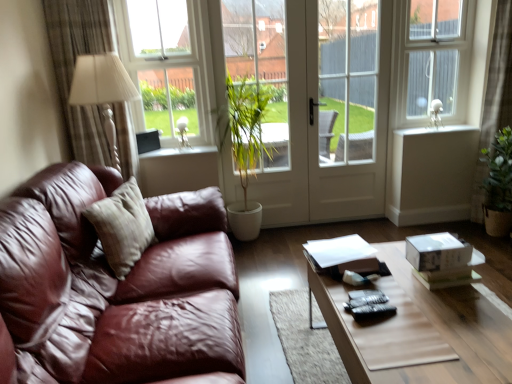
Question: Is silky beige curtain at right, marked as the 1th curtain in a right-to-left arrangement, wider than white smooth window sill at upper right, which ranks as the 1th window sill in top-to-bottom order?

Choices:
 (A) no
 (B) yes

Answer: (B)

Question: Could you tell me if silky beige curtain at right, marked as the 1th curtain in a right-to-left arrangement, is facing white smooth window sill at upper right, the second window sill positioned from the left?

Choices:
 (A) no
 (B) yes

Answer: (A)

Question: From a real-world perspective, is silky beige curtain at right, which is the second curtain in left-to-right order, below white smooth window sill at upper right, which ranks as the 1th window sill in top-to-bottom order?

Choices:
 (A) no
 (B) yes

Answer: (A)

Question: Are silky beige curtain at right, marked as the 1th curtain in a right-to-left arrangement, and white smooth window sill at upper right, the 1th window sill viewed from the right, making contact?

Choices:
 (A) no
 (B) yes

Answer: (A)

Question: Is silky beige curtain at right, which is the second curtain in left-to-right order, bigger than white smooth window sill at upper right, the second window sill positioned from the left?

Choices:
 (A) no
 (B) yes

Answer: (B)

Question: In terms of size, does beige fabric curtain at left, which appears as the first curtain when viewed from the left, appear bigger or smaller than white glossy door at center, which is the 2th screen door in left-to-right order?

Choices:
 (A) small
 (B) big

Answer: (B)

Question: From the image's perspective, is beige fabric curtain at left, which appears as the first curtain when viewed from the left, located above or below white glossy door at center, the first screen door in the right-to-left sequence?

Choices:
 (A) above
 (B) below

Answer: (B)

Question: In the image, is beige fabric curtain at left, which appears as the first curtain when viewed from the left, positioned in front of or behind white glossy door at center, which is the 2th screen door in left-to-right order?

Choices:
 (A) front
 (B) behind

Answer: (A)

Question: Is beige fabric curtain at left, which appears as the first curtain when viewed from the left, taller or shorter than white glossy door at center, the first screen door in the right-to-left sequence?

Choices:
 (A) tall
 (B) short

Answer: (B)

Question: Looking at their shapes, would you say white glossy door at center, the first screen door in the right-to-left sequence, is wider or thinner than white plastic window frame at upper right?

Choices:
 (A) wide
 (B) thin

Answer: (A)

Question: Looking at the image, does white glossy door at center, which is the 2th screen door in left-to-right order, seem bigger or smaller compared to white plastic window frame at upper right?

Choices:
 (A) small
 (B) big

Answer: (B)

Question: Do you think white glossy door at center, the first screen door in the right-to-left sequence, is within white plastic window frame at upper right, or outside of it?

Choices:
 (A) outside
 (B) inside

Answer: (A)

Question: In terms of height, does white glossy door at center, which is the 2th screen door in left-to-right order, look taller or shorter compared to white plastic window frame at upper right?

Choices:
 (A) short
 (B) tall

Answer: (B)

Question: Based on their sizes in the image, would you say white plastic window frame at upper right is bigger or smaller than white glossy screen door at center, which is the first screen door from left to right?

Choices:
 (A) big
 (B) small

Answer: (B)

Question: From the image's perspective, is white plastic window frame at upper right above or below white glossy screen door at center, marked as the second screen door in a right-to-left arrangement?

Choices:
 (A) above
 (B) below

Answer: (A)